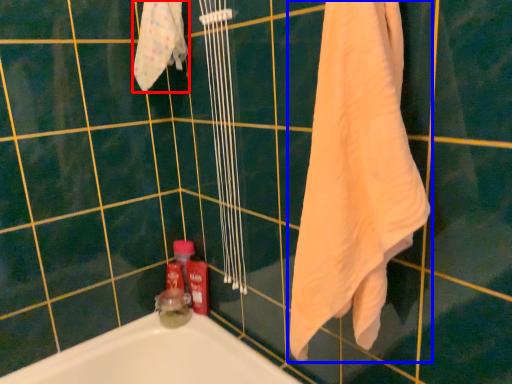
Question: Among these objects, which one is nearest to the camera, bath towel (highlighted by a red box) or towel (highlighted by a blue box)?

Choices:
 (A) bath towel
 (B) towel

Answer: (B)